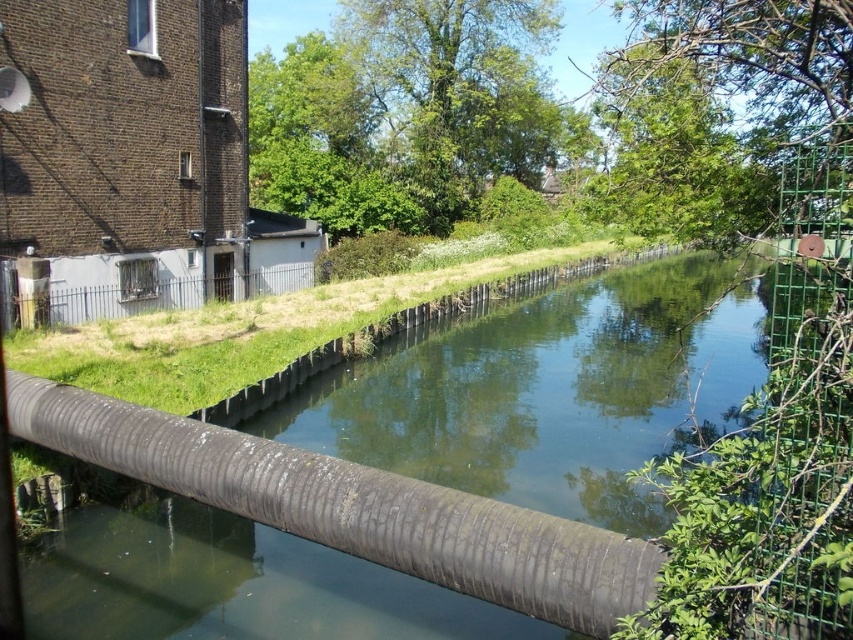
Question: Which point is closer to the camera?

Choices:
 (A) gray metal fence at center-left
 (B) greenish-gray concrete canal at center

Answer: (B)

Question: Is the position of greenish-gray concrete canal at center more distant than that of gray metal fence at center-left?

Choices:
 (A) no
 (B) yes

Answer: (A)

Question: Which object appears closest to the camera in this image?

Choices:
 (A) gray metal fence at center-left
 (B) greenish-gray concrete canal at center

Answer: (B)

Question: Does greenish-gray concrete canal at center appear under gray metal fence at center-left?

Choices:
 (A) no
 (B) yes

Answer: (B)

Question: Is greenish-gray concrete canal at center to the right of gray metal fence at center-left from the viewer's perspective?

Choices:
 (A) no
 (B) yes

Answer: (B)